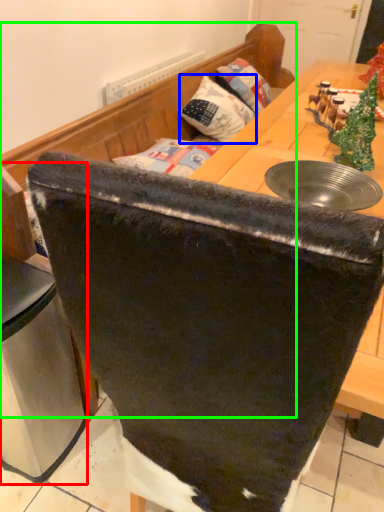
Question: Which object is positioned farthest from leftover (highlighted by a red box)? Select from pillow (highlighted by a blue box) and furniture (highlighted by a green box).

Choices:
 (A) pillow
 (B) furniture

Answer: (A)